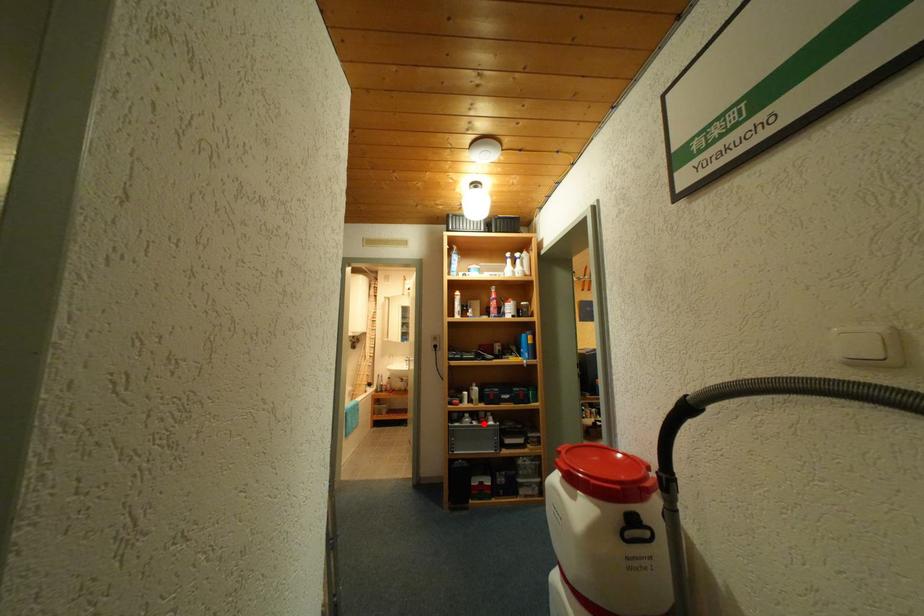
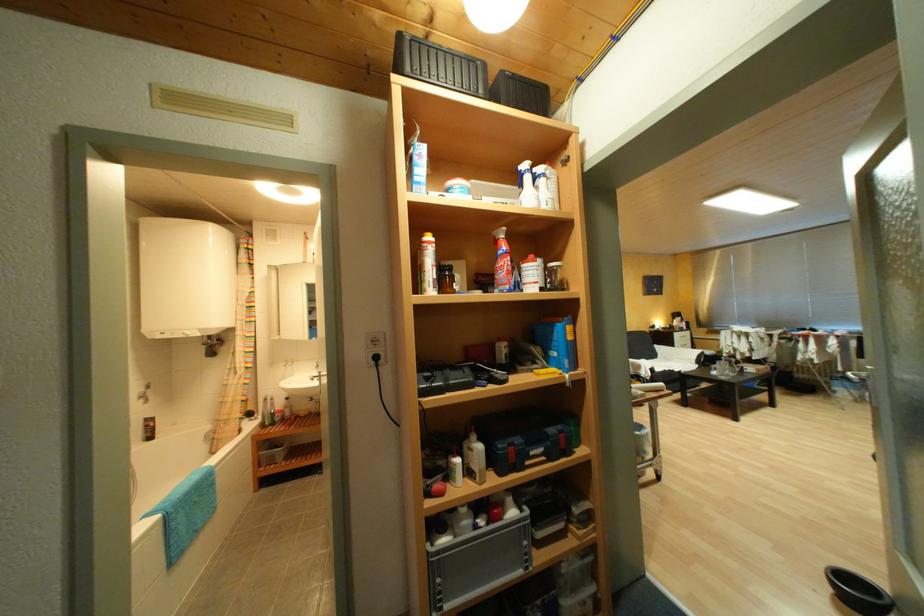
Question: I am providing you with two images of the same scene from different viewpoints. A red point is shown in image1. For the corresponding object point in image2, is it positioned nearer or farther from the camera?

Choices:
 (A) Nearer
 (B) Farther

Answer: (A)